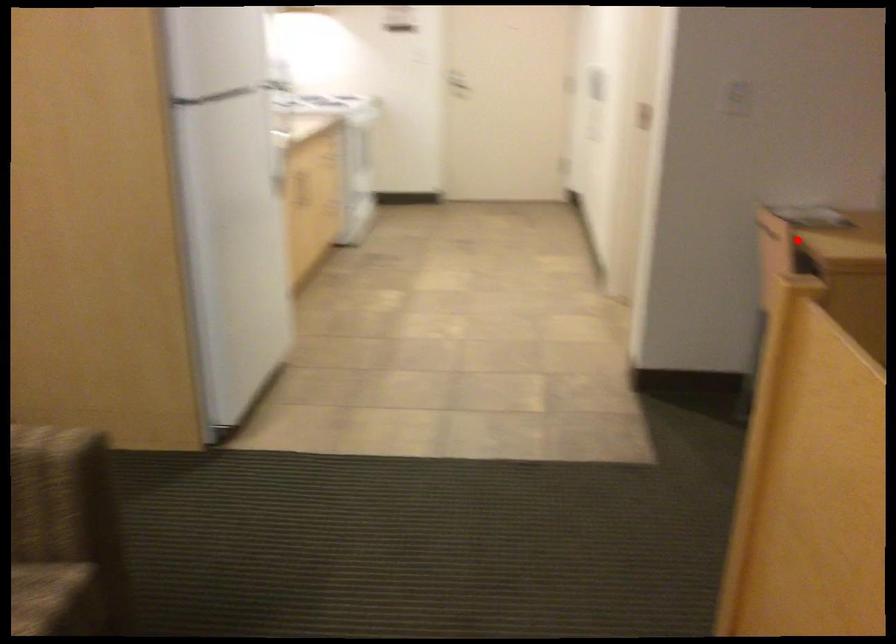
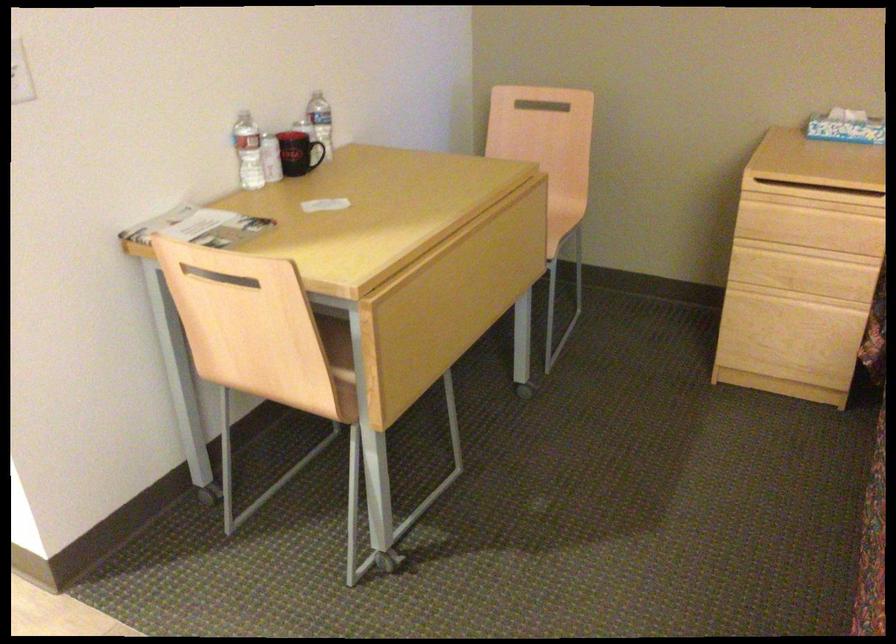
Question: I am providing you with two images of the same scene from different viewpoints. A red point is shown in image1. For the corresponding object point in image2, is it positioned nearer or farther from the camera?

Choices:
 (A) Nearer
 (B) Farther

Answer: (A)